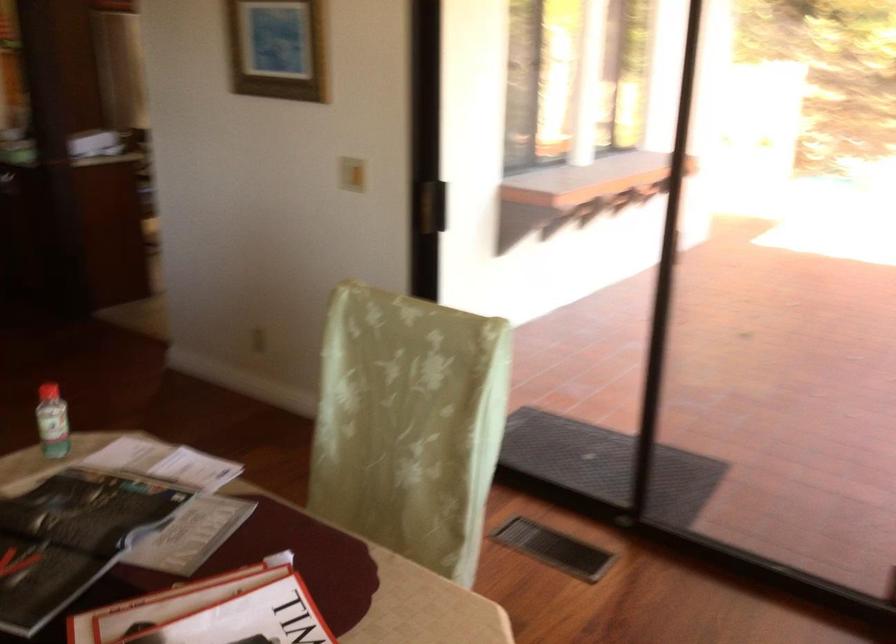
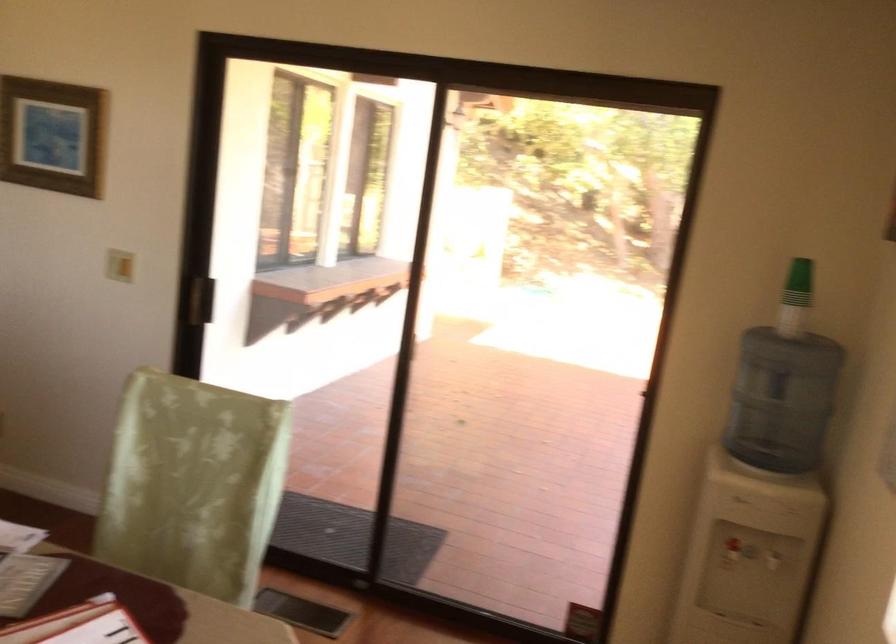
Locate, in the second image, the point that corresponds to (364,178) in the first image.

(119, 265)